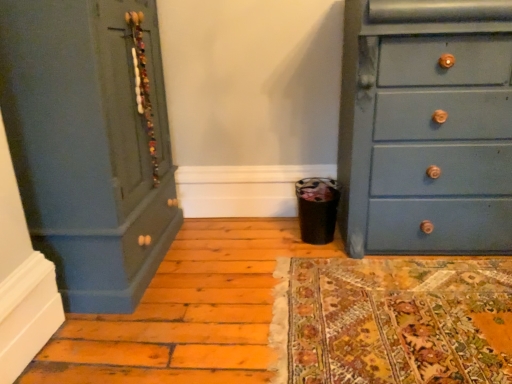
The image size is (512, 384). In order to click on matte blue dresser at right, marked as the first chest of drawers in a right-to-left arrangement in this screenshot , I will do `click(426, 127)`.

The height and width of the screenshot is (384, 512). What do you see at coordinates (426, 127) in the screenshot?
I see `matte blue dresser at right, placed as the second chest of drawers when sorted from left to right` at bounding box center [426, 127].

Describe the element at coordinates (90, 143) in the screenshot. The height and width of the screenshot is (384, 512). I see `matte blue dresser at left, positioned as the 2th chest of drawers in right-to-left order` at that location.

Locate an element on the screen. This screenshot has height=384, width=512. matte blue dresser at left, positioned as the 2th chest of drawers in right-to-left order is located at coordinates (90, 143).

In order to face matte blue dresser at left, positioned as the 2th chest of drawers in right-to-left order, should I rotate leftwards or rightwards?

A 21.976 degree turn to the left will do.

The image size is (512, 384). In order to click on matte blue dresser at right, marked as the first chest of drawers in a right-to-left arrangement in this screenshot , I will do `click(426, 127)`.

Is matte blue dresser at left, the 1th chest of drawers in the left-to-right sequence, to the left or to the right of matte blue dresser at right, marked as the first chest of drawers in a right-to-left arrangement, in the image?

matte blue dresser at left, the 1th chest of drawers in the left-to-right sequence, is to the left of matte blue dresser at right, marked as the first chest of drawers in a right-to-left arrangement.

Between matte blue dresser at left, the 1th chest of drawers in the left-to-right sequence, and matte blue dresser at right, placed as the second chest of drawers when sorted from left to right, which one is positioned behind?

matte blue dresser at right, placed as the second chest of drawers when sorted from left to right, is further away from the camera.

Is point (137, 6) less distant than point (356, 237)?

Yes, point (137, 6) is closer to viewer.

From the image's perspective, is matte blue dresser at left, positioned as the 2th chest of drawers in right-to-left order, above or below matte blue dresser at right, placed as the second chest of drawers when sorted from left to right?

Clearly, from the image's perspective, matte blue dresser at left, positioned as the 2th chest of drawers in right-to-left order, is below matte blue dresser at right, placed as the second chest of drawers when sorted from left to right.

From a real-world perspective, is matte blue dresser at left, positioned as the 2th chest of drawers in right-to-left order, over matte blue dresser at right, marked as the first chest of drawers in a right-to-left arrangement?

Yes, from a real-world perspective, matte blue dresser at left, positioned as the 2th chest of drawers in right-to-left order, is over matte blue dresser at right, marked as the first chest of drawers in a right-to-left arrangement

Between matte blue dresser at left, positioned as the 2th chest of drawers in right-to-left order, and matte blue dresser at right, marked as the first chest of drawers in a right-to-left arrangement, which one has smaller width?

Thinner between the two is matte blue dresser at right, marked as the first chest of drawers in a right-to-left arrangement.

Considering the relative sizes of matte blue dresser at left, the 1th chest of drawers in the left-to-right sequence, and matte blue dresser at right, marked as the first chest of drawers in a right-to-left arrangement, in the image provided, is matte blue dresser at left, the 1th chest of drawers in the left-to-right sequence, shorter than matte blue dresser at right, marked as the first chest of drawers in a right-to-left arrangement,?

In fact, matte blue dresser at left, the 1th chest of drawers in the left-to-right sequence, may be taller than matte blue dresser at right, marked as the first chest of drawers in a right-to-left arrangement.

Which of these two, matte blue dresser at left, positioned as the 2th chest of drawers in right-to-left order, or matte blue dresser at right, placed as the second chest of drawers when sorted from left to right, is smaller?

matte blue dresser at right, placed as the second chest of drawers when sorted from left to right.

Is matte blue dresser at left, positioned as the 2th chest of drawers in right-to-left order, surrounding matte blue dresser at right, marked as the first chest of drawers in a right-to-left arrangement?

No.

Is matte blue dresser at left, the 1th chest of drawers in the left-to-right sequence, with matte blue dresser at right, placed as the second chest of drawers when sorted from left to right?

No, matte blue dresser at left, the 1th chest of drawers in the left-to-right sequence, is not beside matte blue dresser at right, placed as the second chest of drawers when sorted from left to right.

Is matte blue dresser at left, positioned as the 2th chest of drawers in right-to-left order, turned away from matte blue dresser at right, placed as the second chest of drawers when sorted from left to right?

matte blue dresser at left, positioned as the 2th chest of drawers in right-to-left order, is not turned away from matte blue dresser at right, placed as the second chest of drawers when sorted from left to right.

How far apart are matte blue dresser at left, positioned as the 2th chest of drawers in right-to-left order, and matte blue dresser at right, marked as the first chest of drawers in a right-to-left arrangement?

matte blue dresser at left, positioned as the 2th chest of drawers in right-to-left order, and matte blue dresser at right, marked as the first chest of drawers in a right-to-left arrangement, are 1.16 meters apart.

I want to click on chest of drawers on the left of matte blue dresser at right, placed as the second chest of drawers when sorted from left to right, so click(x=90, y=143).

Considering the relative positions of matte blue dresser at right, placed as the second chest of drawers when sorted from left to right, and matte blue dresser at left, positioned as the 2th chest of drawers in right-to-left order, in the image provided, is matte blue dresser at right, placed as the second chest of drawers when sorted from left to right, to the left of matte blue dresser at left, positioned as the 2th chest of drawers in right-to-left order, from the viewer's perspective?

No, matte blue dresser at right, placed as the second chest of drawers when sorted from left to right, is not to the left of matte blue dresser at left, positioned as the 2th chest of drawers in right-to-left order.

Is the position of matte blue dresser at right, marked as the first chest of drawers in a right-to-left arrangement, less distant than that of matte blue dresser at left, the 1th chest of drawers in the left-to-right sequence?

No, matte blue dresser at right, marked as the first chest of drawers in a right-to-left arrangement, is behind matte blue dresser at left, the 1th chest of drawers in the left-to-right sequence.

Which is less distant, (380,181) or (94,255)?

Positioned in front is point (94,255).

From the image's perspective, which is below, matte blue dresser at right, placed as the second chest of drawers when sorted from left to right, or matte blue dresser at left, positioned as the 2th chest of drawers in right-to-left order?

matte blue dresser at left, positioned as the 2th chest of drawers in right-to-left order, is shown below in the image.

From a real-world perspective, is matte blue dresser at right, marked as the first chest of drawers in a right-to-left arrangement, positioned above or below matte blue dresser at left, positioned as the 2th chest of drawers in right-to-left order?

Clearly, from a real-world perspective, matte blue dresser at right, marked as the first chest of drawers in a right-to-left arrangement, is below matte blue dresser at left, positioned as the 2th chest of drawers in right-to-left order.

Is matte blue dresser at right, placed as the second chest of drawers when sorted from left to right, thinner than matte blue dresser at left, the 1th chest of drawers in the left-to-right sequence?

Yes, matte blue dresser at right, placed as the second chest of drawers when sorted from left to right, is thinner than matte blue dresser at left, the 1th chest of drawers in the left-to-right sequence.

Is matte blue dresser at right, placed as the second chest of drawers when sorted from left to right, shorter than matte blue dresser at left, positioned as the 2th chest of drawers in right-to-left order?

Correct, matte blue dresser at right, placed as the second chest of drawers when sorted from left to right, is not as tall as matte blue dresser at left, positioned as the 2th chest of drawers in right-to-left order.

Looking at this image, between matte blue dresser at right, placed as the second chest of drawers when sorted from left to right, and matte blue dresser at left, the 1th chest of drawers in the left-to-right sequence, which one has larger size?

Bigger between the two is matte blue dresser at left, the 1th chest of drawers in the left-to-right sequence.

Is matte blue dresser at right, placed as the second chest of drawers when sorted from left to right, outside of matte blue dresser at left, the 1th chest of drawers in the left-to-right sequence?

Indeed, matte blue dresser at right, placed as the second chest of drawers when sorted from left to right, is completely outside matte blue dresser at left, the 1th chest of drawers in the left-to-right sequence.

Is matte blue dresser at right, placed as the second chest of drawers when sorted from left to right, far from matte blue dresser at left, the 1th chest of drawers in the left-to-right sequence?

matte blue dresser at right, placed as the second chest of drawers when sorted from left to right, is positioned a significant distance from matte blue dresser at left, the 1th chest of drawers in the left-to-right sequence.

Is matte blue dresser at left, positioned as the 2th chest of drawers in right-to-left order, at the back of matte blue dresser at right, marked as the first chest of drawers in a right-to-left arrangement?

No, matte blue dresser at right, marked as the first chest of drawers in a right-to-left arrangement, is not facing the opposite direction of matte blue dresser at left, positioned as the 2th chest of drawers in right-to-left order.

Could you measure the distance between matte blue dresser at right, placed as the second chest of drawers when sorted from left to right, and matte blue dresser at left, positioned as the 2th chest of drawers in right-to-left order?

matte blue dresser at right, placed as the second chest of drawers when sorted from left to right, is 3.80 feet from matte blue dresser at left, positioned as the 2th chest of drawers in right-to-left order.

The image size is (512, 384). I want to click on the chest of drawers in front of the matte blue dresser at right, placed as the second chest of drawers when sorted from left to right, so point(90,143).

You are a GUI agent. You are given a task and a screenshot of the screen. Output one action in this format:
    pyautogui.click(x=<x>, y=<y>)
    Task: Click on the chest of drawers on the left of matte blue dresser at right, marked as the first chest of drawers in a right-to-left arrangement
    The image size is (512, 384).
    Given the screenshot: What is the action you would take?
    pyautogui.click(x=90, y=143)

The height and width of the screenshot is (384, 512). I want to click on the chest of drawers that appears above the matte blue dresser at right, placed as the second chest of drawers when sorted from left to right (from a real-world perspective), so [90, 143].